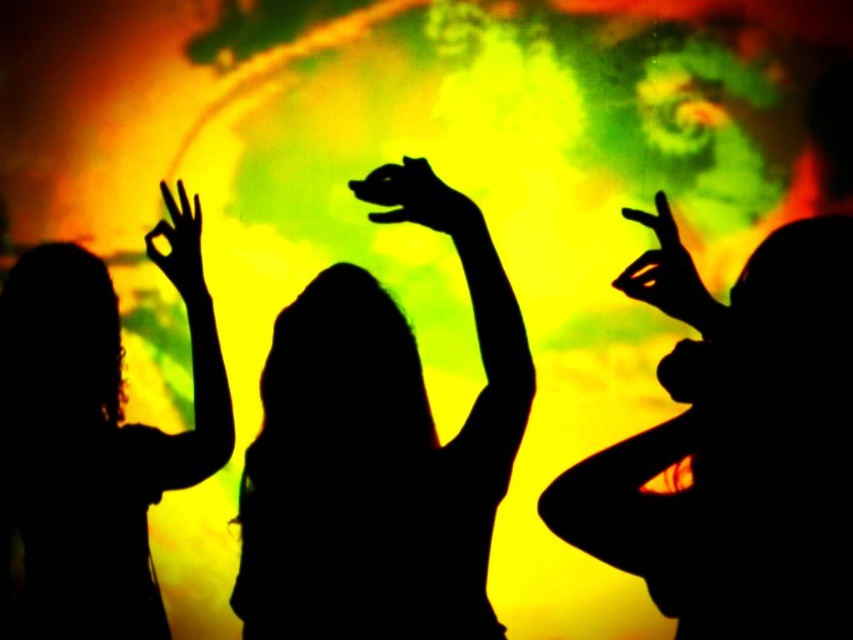
You are a photographer trying to capture the perfect shot of the black silhouette at center and the black matte hand at center. Based on their positions, which object should you adjust your camera to focus on first if you want to capture them both in the same frame?

The black silhouette at center is to the left of the black matte hand at center, so you should focus on the black silhouette at center first to ensure both are in the frame.

In the scene shown: You are standing in front of the image. There is a point at coordinates (379, 449). What object is located at that point?

The point at coordinates (379, 449) indicates the black silhouette at center.